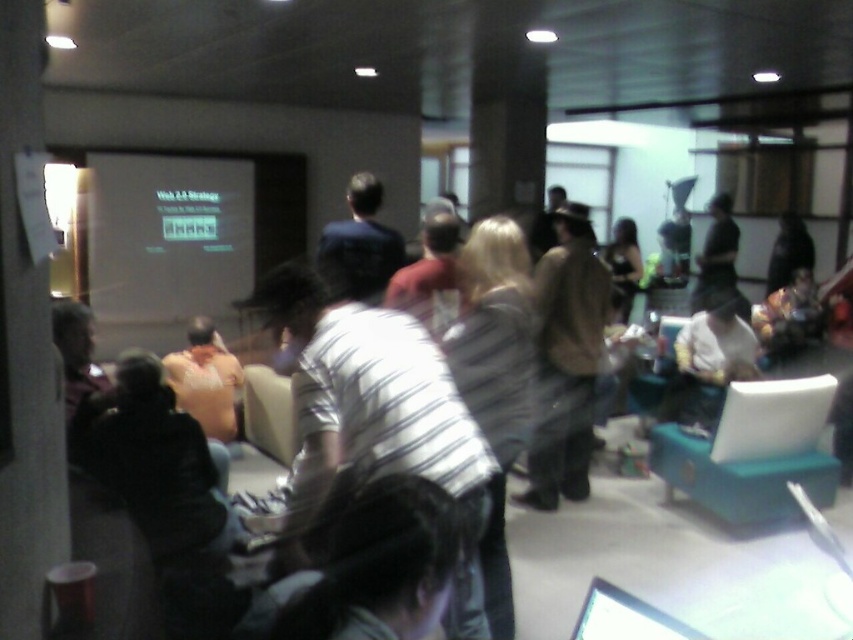
Question: Does matte white projector screen at left lie in front of dark blue shirt at center?

Choices:
 (A) no
 (B) yes

Answer: (A)

Question: Does matte white projector screen at left appear over brown leather jacket at center?

Choices:
 (A) yes
 (B) no

Answer: (A)

Question: Which point is farther from the camera taking this photo?

Choices:
 (A) (248, 276)
 (B) (376, 244)

Answer: (A)

Question: Which object appears farthest from the camera in this image?

Choices:
 (A) dark blue shirt at center
 (B) matte white projector screen at left

Answer: (B)

Question: Does brown leather jacket at center appear on the left side of dark blue shirt at center?

Choices:
 (A) yes
 (B) no

Answer: (B)

Question: Which point is closer to the camera?

Choices:
 (A) (387, 260)
 (B) (547, 484)

Answer: (A)